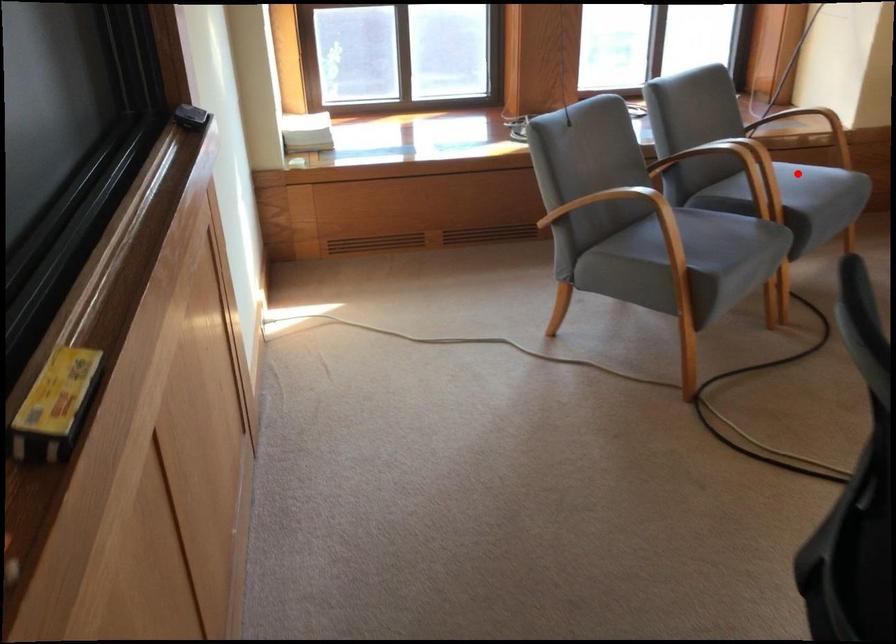
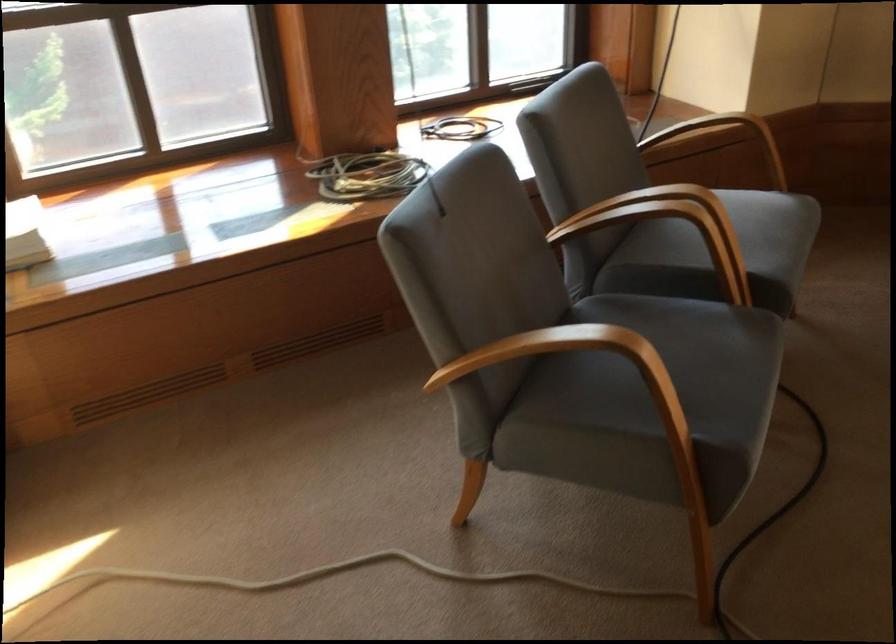
Question: I am providing you with two images of the same scene from different viewpoints. A red point is shown in image1. For the corresponding object point in image2, is it positioned nearer or farther from the camera?

Choices:
 (A) Nearer
 (B) Farther

Answer: (A)